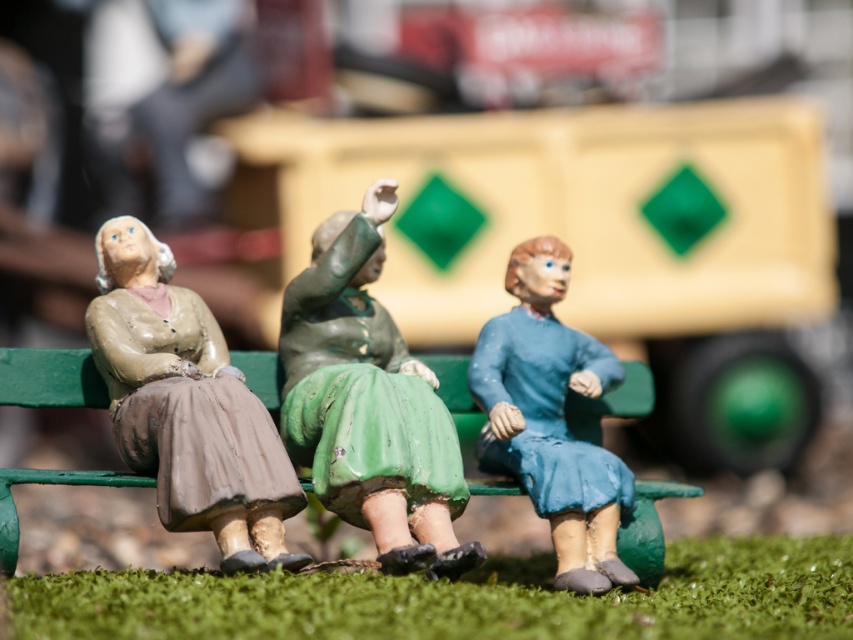
Question: Can you confirm if green matte figure at center is wider than blue matte figure at center?

Choices:
 (A) yes
 (B) no

Answer: (A)

Question: Is matte clay figure at left positioned before blue matte figure at center?

Choices:
 (A) yes
 (B) no

Answer: (A)

Question: Which object is closer to the camera taking this photo?

Choices:
 (A) green painted wood park bench at center
 (B) matte clay figure at left
 (C) green matte figure at center

Answer: (B)

Question: Which point is closer to the camera?

Choices:
 (A) (206, 342)
 (B) (292, 326)
 (C) (123, 481)
 (D) (521, 371)

Answer: (C)

Question: Which point is farther from the camera taking this photo?

Choices:
 (A) (229, 522)
 (B) (593, 408)

Answer: (B)

Question: Where is green matte figure at center located in relation to matte clay figure at left in the image?

Choices:
 (A) below
 (B) above

Answer: (B)